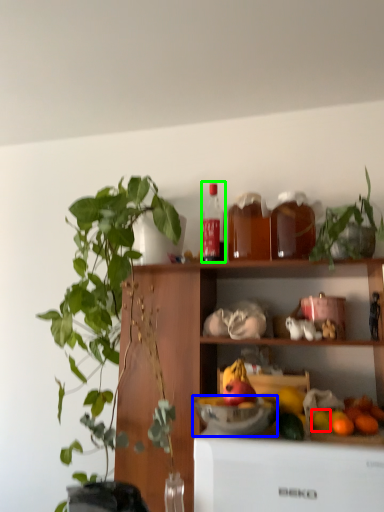
Question: Based on their relative distances, which object is farther from fruit (highlighted by a red box)? Choose from bowl (highlighted by a blue box) and bottle (highlighted by a green box).

Choices:
 (A) bowl
 (B) bottle

Answer: (B)